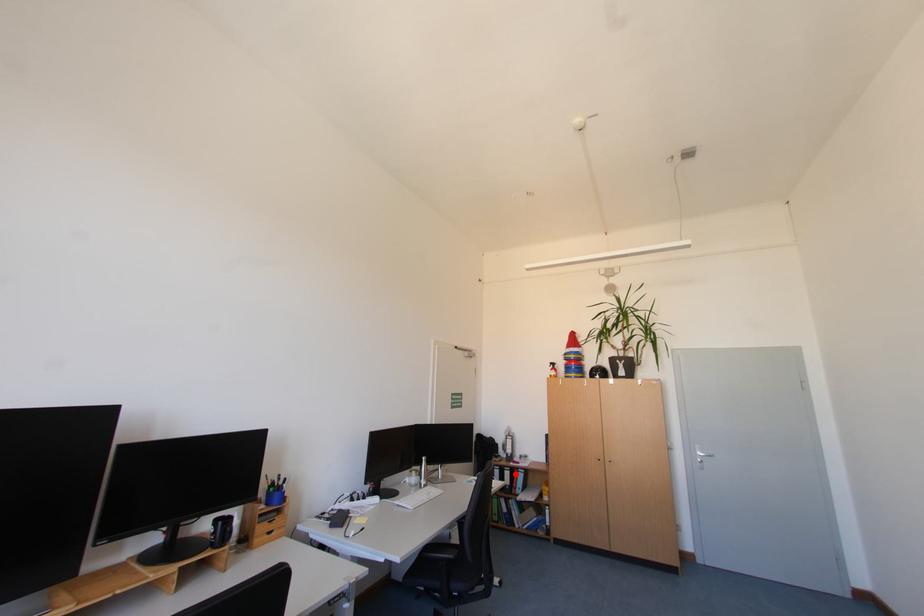
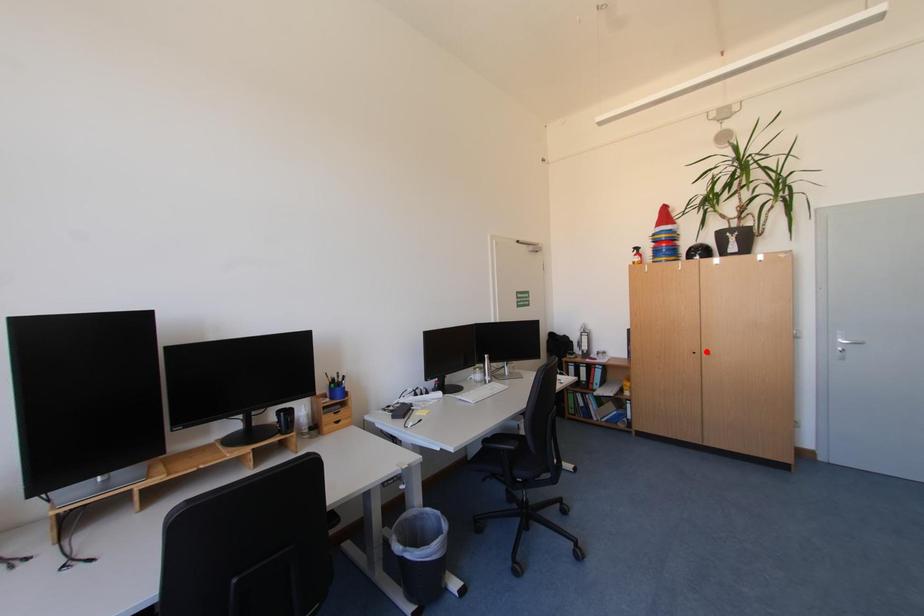
I am providing you with two images of the same scene from different viewpoints. A red point is marked on the first image and another point is marked on the second image. Is the red point in image1 aligned with the point shown in image2?

No